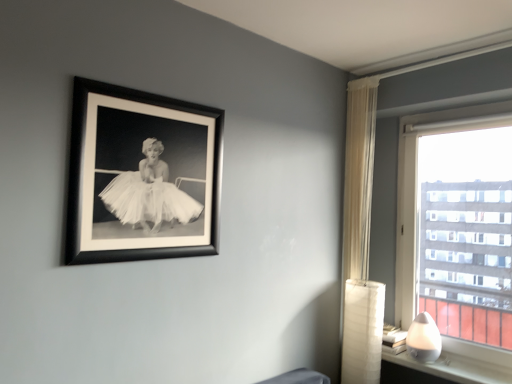
Describe the element at coordinates (404, 148) in the screenshot. Image resolution: width=512 pixels, height=384 pixels. I see `transparent glass window at right` at that location.

Find the location of a particular element. This screenshot has width=512, height=384. white glossy table lamp at lower right is located at coordinates (424, 339).

Is white glossy table lamp at lower right with sheer white curtain at right?

They are not placed beside each other.

From the image's perspective, is white glossy table lamp at lower right positioned above or below sheer white curtain at right?

white glossy table lamp at lower right is below sheer white curtain at right.

Is white glossy table lamp at lower right wider than sheer white curtain at right?

Correct, the width of white glossy table lamp at lower right exceeds that of sheer white curtain at right.

Is white glossy table lamp at lower right oriented towards sheer white curtain at right?

No, white glossy table lamp at lower right is not aimed at sheer white curtain at right.

Who is shorter, white glossy table lamp at lower right or black matte picture frame at upper left?

With less height is white glossy table lamp at lower right.

Is white glossy table lamp at lower right wider than black matte picture frame at upper left?

Yes, white glossy table lamp at lower right is wider than black matte picture frame at upper left.

Which point is more distant from viewer, [419,344] or [100,94]?

The point [419,344] is farther from the camera.

How different are the orientations of transparent glass window at right and white glossy lamp at lower right in degrees?

0.35 degrees separate the facing orientations of transparent glass window at right and white glossy lamp at lower right.

How much distance is there between transparent glass window at right and white glossy lamp at lower right?

transparent glass window at right is 32.63 inches from white glossy lamp at lower right.

Is transparent glass window at right thinner than white glossy lamp at lower right?

Yes, transparent glass window at right is thinner than white glossy lamp at lower right.

From the image's perspective, is transparent glass window at right beneath white glossy lamp at lower right?

Incorrect, from the image's perspective, transparent glass window at right is higher than white glossy lamp at lower right.

Identify the location of window in front of the sheer white curtain at right. This screenshot has width=512, height=384. (404, 148).

Can you tell me how much transparent glass window at right and sheer white curtain at right differ in facing direction?

transparent glass window at right and sheer white curtain at right are facing 0.562 degrees away from each other.

From the image's perspective, between transparent glass window at right and sheer white curtain at right, who is located below?

transparent glass window at right appears lower in the image.

Is transparent glass window at right facing away from sheer white curtain at right?

No, transparent glass window at right's orientation is not away from sheer white curtain at right.

From the image's perspective, between white glossy table lamp at lower right and transparent glass window at right, who is located below?

white glossy table lamp at lower right appears lower in the image.

Is white glossy table lamp at lower right turned away from transparent glass window at right?

Yes, transparent glass window at right is at the back of white glossy table lamp at lower right.

Relative to transparent glass window at right, is white glossy table lamp at lower right in front or behind?

Result: white glossy table lamp at lower right is positioned farther from the viewer than transparent glass window at right.

Does white glossy table lamp at lower right have a smaller size compared to transparent glass window at right?

Correct, white glossy table lamp at lower right occupies less space than transparent glass window at right.

Which is closer, (x=423, y=338) or (x=504, y=378)?

Clearly, point (x=423, y=338) is more distant from the camera than point (x=504, y=378).

From a real-world perspective, between white glossy table lamp at lower right and white glossy lamp at lower right, who is vertically lower?

In real-world perspective, white glossy lamp at lower right is lower.

What's the angular difference between white glossy table lamp at lower right and white glossy lamp at lower right's facing directions?

The angular difference between white glossy table lamp at lower right and white glossy lamp at lower right is 1.74 degrees.

Does white glossy table lamp at lower right lie behind white glossy lamp at lower right?

Yes, white glossy table lamp at lower right is further from the viewer.

Is white glossy lamp at lower right facing away from black matte picture frame at upper left?

No, white glossy lamp at lower right's orientation is not away from black matte picture frame at upper left.

Is white glossy lamp at lower right bigger than black matte picture frame at upper left?

No.

Is white glossy lamp at lower right placed right next to black matte picture frame at upper left?

No, white glossy lamp at lower right is not making contact with black matte picture frame at upper left.

From a real-world perspective, is white glossy lamp at lower right physically above black matte picture frame at upper left?

No, from a real-world perspective, white glossy lamp at lower right is not over black matte picture frame at upper left

In order to click on table lamp in front of the sheer white curtain at right in this screenshot , I will do `click(424, 339)`.

You are a GUI agent. You are given a task and a screenshot of the screen. Output one action in this format:
    pyautogui.click(x=<x>, y=<y>)
    Task: Click on the picture frame above the white glossy table lamp at lower right (from the image's perspective)
    
    Given the screenshot: What is the action you would take?
    pyautogui.click(x=141, y=176)

Considering their positions, is transparent glass window at right positioned further to white glossy lamp at lower right than black matte picture frame at upper left?

black matte picture frame at upper left lies further to white glossy lamp at lower right than the other object.

When comparing their distances from sheer white curtain at right, does black matte picture frame at upper left or transparent glass window at right seem closer?

transparent glass window at right lies closer to sheer white curtain at right than the other object.

Considering their positions, is white glossy lamp at lower right positioned further to white glossy table lamp at lower right than sheer white curtain at right?

sheer white curtain at right lies further to white glossy table lamp at lower right than the other object.

Which object lies nearer to the anchor point sheer white curtain at right, white glossy table lamp at lower right or black matte picture frame at upper left?

white glossy table lamp at lower right is positioned closer to the anchor sheer white curtain at right.

Based on their spatial positions, is white glossy table lamp at lower right or sheer white curtain at right closer to black matte picture frame at upper left?

The object closer to black matte picture frame at upper left is sheer white curtain at right.

From the image, which object appears to be nearer to white glossy lamp at lower right, white glossy table lamp at lower right or sheer white curtain at right?

Among the two, white glossy table lamp at lower right is located nearer to white glossy lamp at lower right.

Considering their positions, is black matte picture frame at upper left positioned further to white glossy lamp at lower right than white glossy table lamp at lower right?

black matte picture frame at upper left is positioned further to the anchor white glossy lamp at lower right.

From the image, which object appears to be nearer to transparent glass window at right, black matte picture frame at upper left or sheer white curtain at right?

sheer white curtain at right lies closer to transparent glass window at right than the other object.

Locate an element on the screen. This screenshot has width=512, height=384. window that lies between sheer white curtain at right and white glossy table lamp at lower right from top to bottom is located at coordinates (404, 148).

Image resolution: width=512 pixels, height=384 pixels. What are the coordinates of `curtain situated between black matte picture frame at upper left and white glossy table lamp at lower right from left to right` in the screenshot? It's located at (360, 241).

Where is `table lamp that lies between transparent glass window at right and white glossy lamp at lower right from top to bottom`? The width and height of the screenshot is (512, 384). table lamp that lies between transparent glass window at right and white glossy lamp at lower right from top to bottom is located at coordinates (424, 339).

This screenshot has width=512, height=384. I want to click on window located between black matte picture frame at upper left and white glossy lamp at lower right in the left-right direction, so click(404, 148).